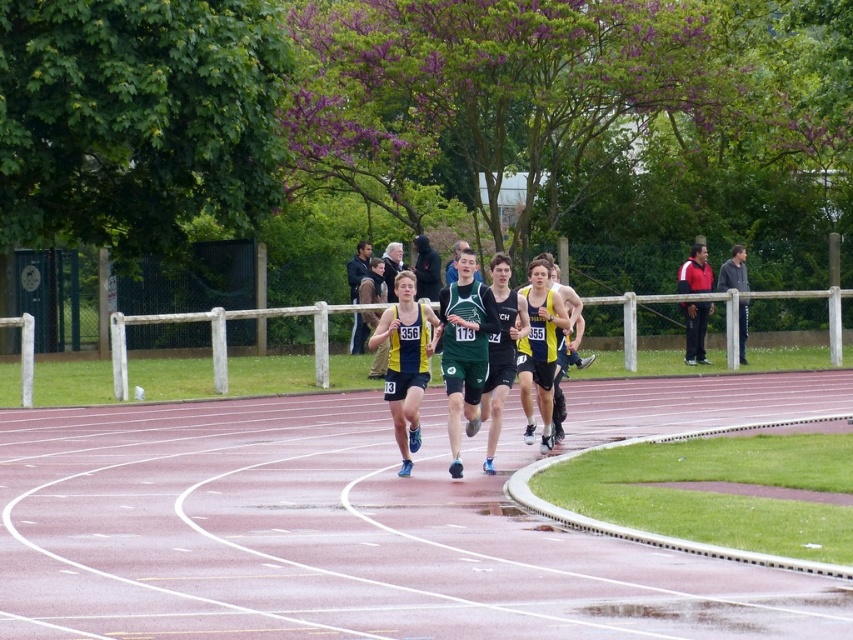
Measure the distance between pink rubber track at center and yellow/green jersey at center.

pink rubber track at center and yellow/green jersey at center are 3.54 meters apart.

Does pink rubber track at center have a lesser height compared to yellow/green jersey at center?

Answer: Indeed, pink rubber track at center has a lesser height compared to yellow/green jersey at center.

Which is in front, point (625, 545) or point (404, 392)?

Point (625, 545) is in front.

This screenshot has height=640, width=853. I want to click on pink rubber track at center, so click(x=334, y=538).

Is green athletic uniform at center shorter than green matte jersey at center?

Incorrect, green athletic uniform at center's height does not fall short of green matte jersey at center's.

Can you confirm if green athletic uniform at center is thinner than green matte jersey at center?

No.

You are a GUI agent. You are given a task and a screenshot of the screen. Output one action in this format:
    pyautogui.click(x=<x>, y=<y>)
    Task: Click on the green athletic uniform at center
    
    Given the screenshot: What is the action you would take?
    pyautogui.click(x=467, y=348)

Measure the distance between pink rubber track at center and red and white jacket at upper right.

pink rubber track at center is 8.05 meters away from red and white jacket at upper right.

Is pink rubber track at center shorter than red and white jacket at upper right?

Indeed, pink rubber track at center has a lesser height compared to red and white jacket at upper right.

Find the location of a particular element. This screenshot has height=640, width=853. pink rubber track at center is located at coordinates (334, 538).